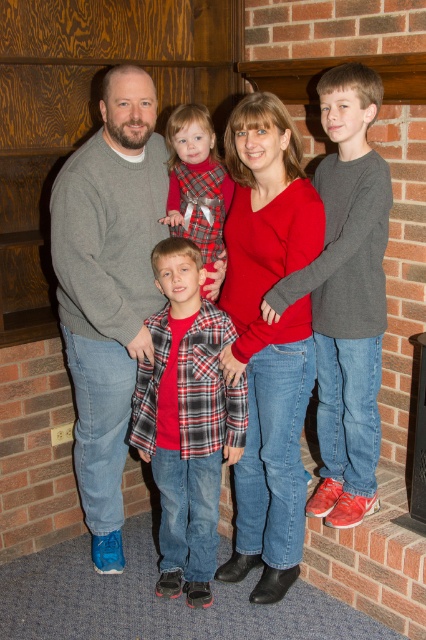
You are trying to decide which clothing item to take from the center of the image for a quick grab. The options are the matte red sweater at center and the plaid fabric dress at center. Based on their sizes, which one is larger?

The matte red sweater at center might be wider than plaid fabric dress at center, so it is likely larger in size.

You are trying to decide which item of clothing to take for a casual family gathering. The matte gray sweater at upper left and the plaid fabric dress at center are both options. Which one is wider?

The matte gray sweater at upper left is wider than the plaid fabric dress at center.